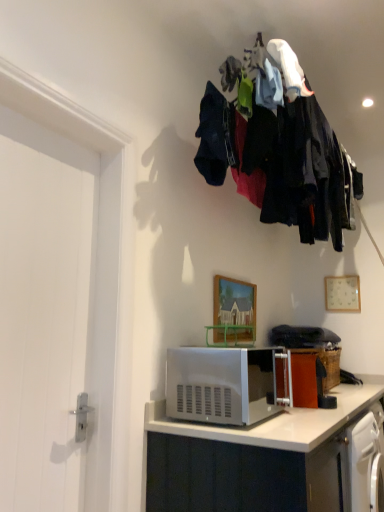
Question: From a real-world perspective, is wooden painted picture frame at center, placed as the first picture frame when sorted from front to back, positioned above or below satin silver microwave at lower center?

Choices:
 (A) below
 (B) above

Answer: (B)

Question: Relative to satin silver microwave at lower center, is wooden painted picture frame at center, the first picture frame positioned from the left, in front or behind?

Choices:
 (A) behind
 (B) front

Answer: (A)

Question: Which is nearer to the silver metallic microwave at lower center?

Choices:
 (A) satin silver microwave at lower center
 (B) white smooth door at left
 (C) wooden picture frame at upper right, which is counted as the 2th picture frame, starting from the left
 (D) wooden painted picture frame at center, the second picture frame positioned from the back
 (E) dark fabric clothes at upper center

Answer: (A)

Question: Estimate the real-world distances between objects in this image. Which object is farther from the white smooth door at left?

Choices:
 (A) wooden painted picture frame at center, the second picture frame from the right
 (B) wooden picture frame at upper right, which is counted as the 2th picture frame, starting from the left
 (C) dark fabric clothes at upper center
 (D) satin silver microwave at lower center
 (E) silver metallic microwave at lower center

Answer: (B)